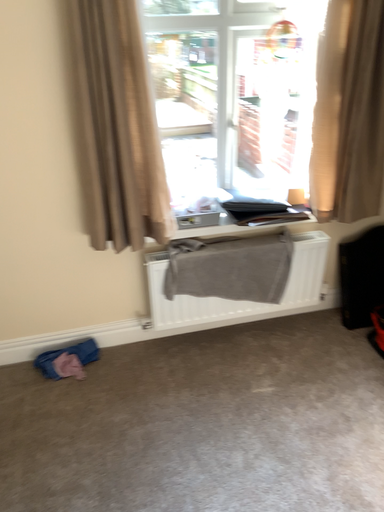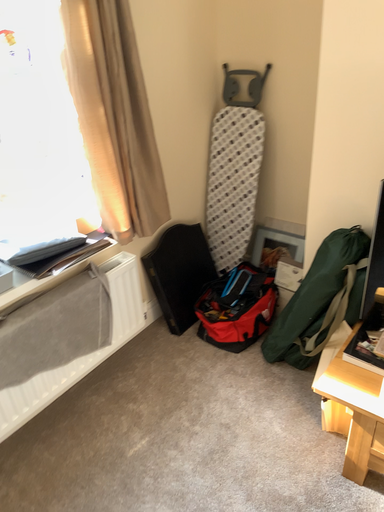
Question: Which way did the camera rotate in the video?

Choices:
 (A) rotated right
 (B) rotated left

Answer: (A)